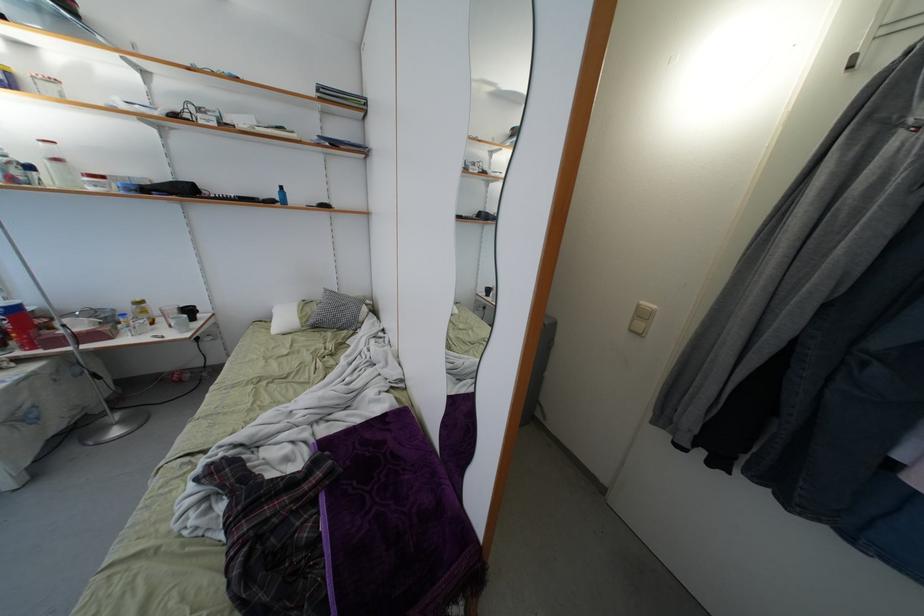
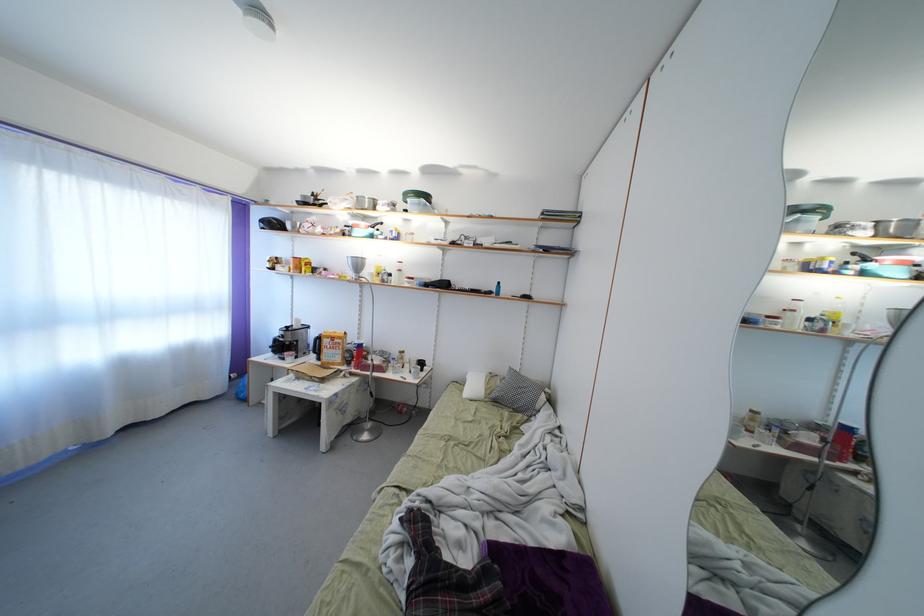
Question: The camera is either moving clockwise (left) or counter-clockwise (right) around the object. The first image is from the beginning of the video and the second image is from the end. Is the camera moving left or right when shooting the video?

Choices:
 (A) Left
 (B) Right

Answer: (B)